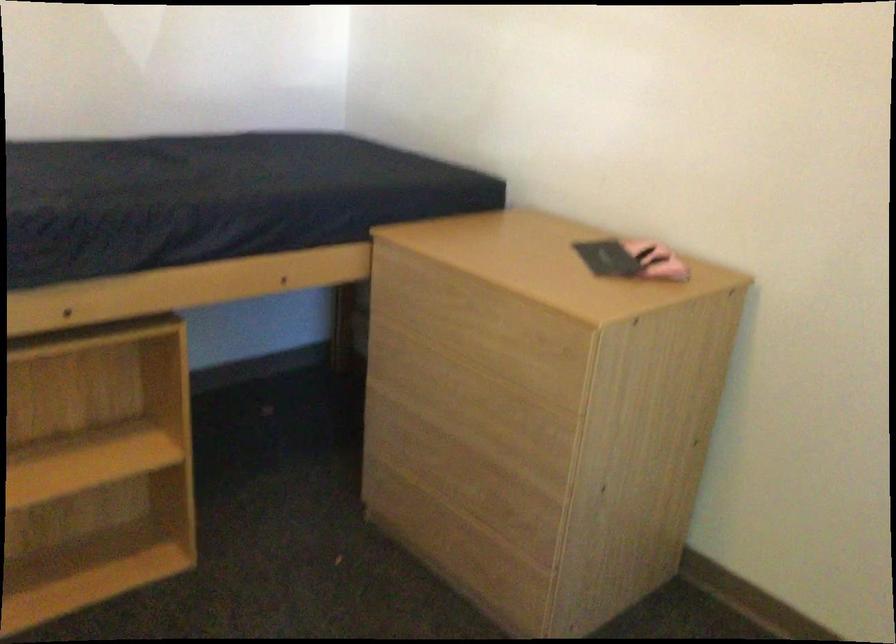
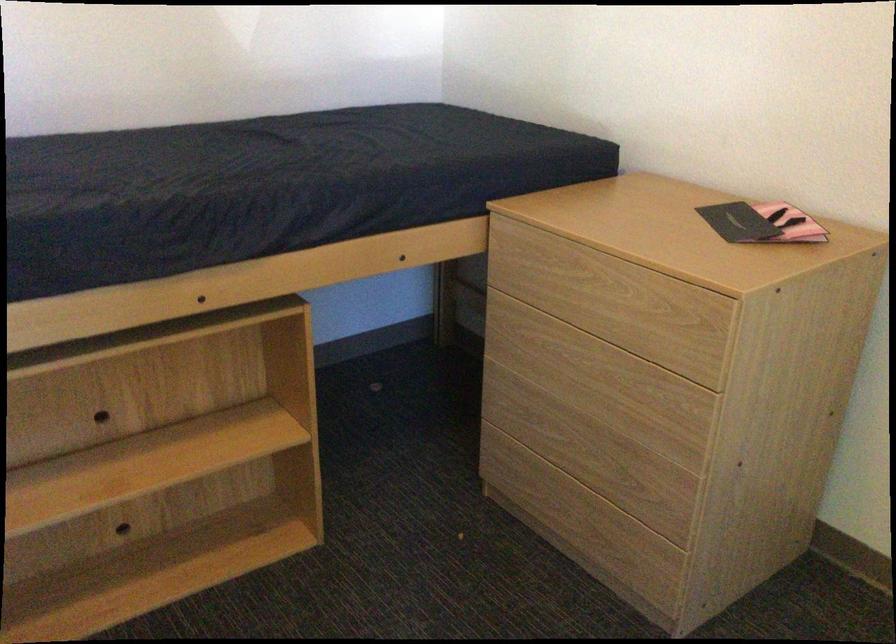
Locate, in the second image, the point that corresponds to (x=460, y=315) in the first image.

(582, 287)